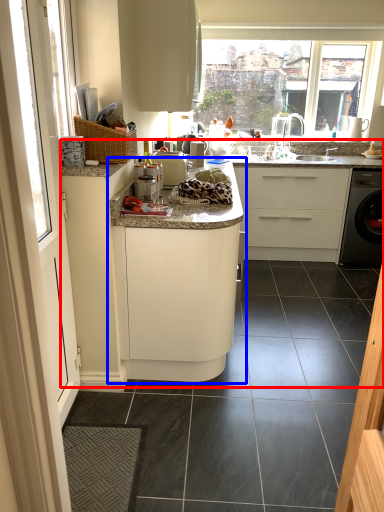
Question: Which of the following is the closest to the observer, counter top (highlighted by a red box) or cabinetry (highlighted by a blue box)?

Choices:
 (A) counter top
 (B) cabinetry

Answer: (A)